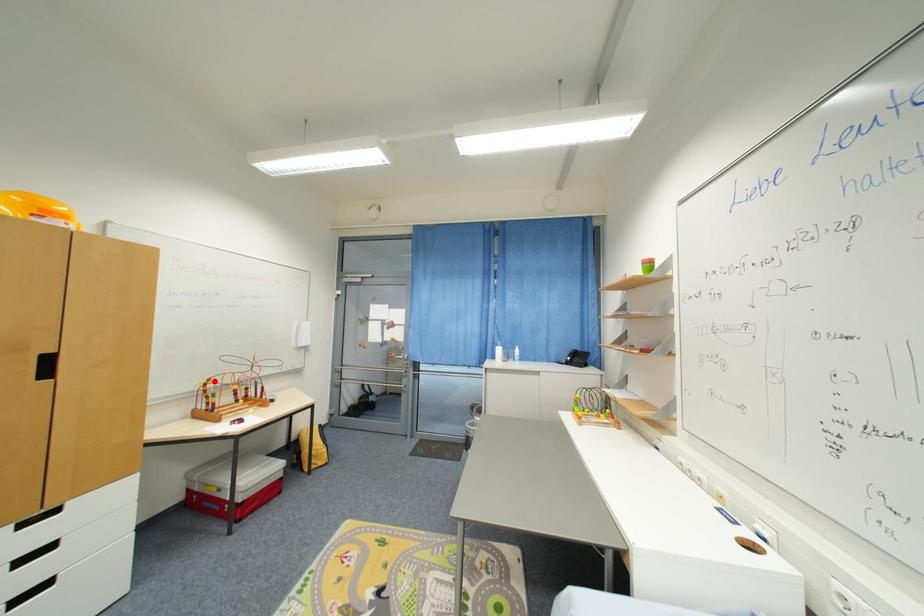
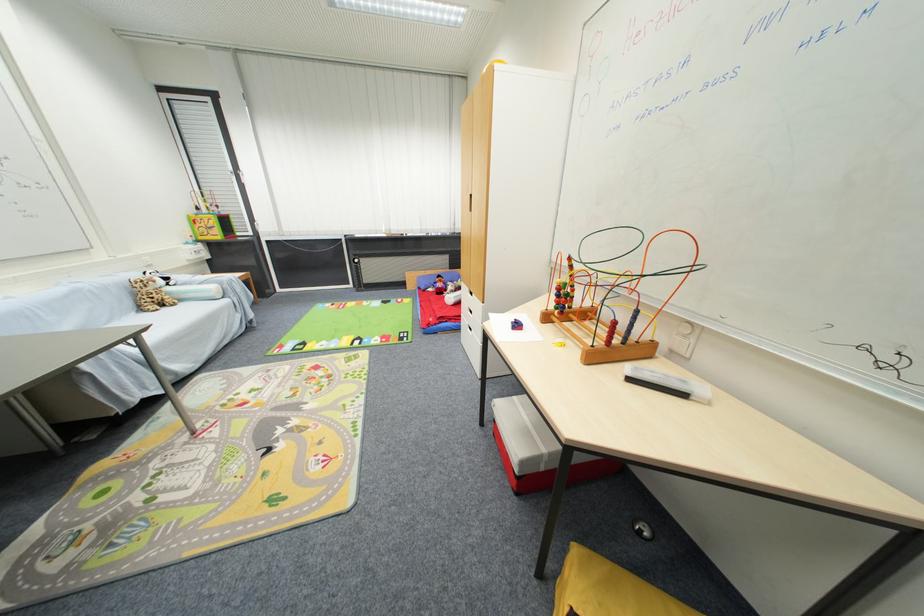
Question: I am providing you with two images of the same scene from different viewpoints. A red point is shown in image1. For the corresponding object point in image2, is it positioned nearer or farther from the camera?

Choices:
 (A) Nearer
 (B) Farther

Answer: (A)